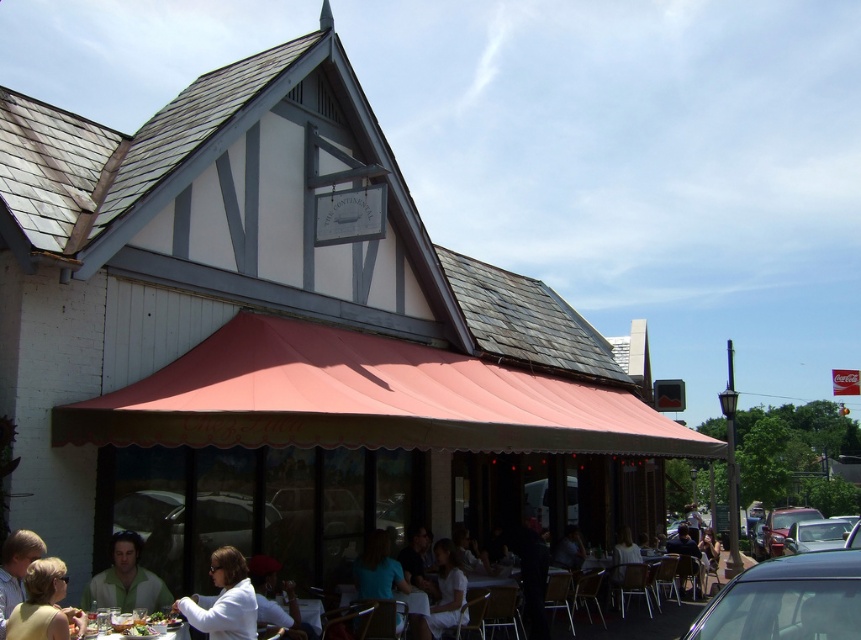
Is metallic blue car at lower right wider than green matte shirt at lower center?

Correct, the width of metallic blue car at lower right exceeds that of green matte shirt at lower center.

In the scene shown: Which is more to the right, metallic blue car at lower right or green matte shirt at lower center?

From the viewer's perspective, metallic blue car at lower right appears more on the right side.

The image size is (861, 640). What are the coordinates of `metallic blue car at lower right` in the screenshot? It's located at (787, 600).

Identify the location of metallic blue car at lower right. (787, 600).

Who is lower down, metallic blue car at lower right or white matte shirt at lower center?

white matte shirt at lower center is below.

Measure the distance between point (728, 586) and camera.

Point (728, 586) is 5.61 meters from camera.

The height and width of the screenshot is (640, 861). What are the coordinates of `metallic blue car at lower right` in the screenshot? It's located at (787, 600).

Can you confirm if green matte shirt at lower center is thinner than white fabric dress at lower center?

In fact, green matte shirt at lower center might be wider than white fabric dress at lower center.

Is green matte shirt at lower center shorter than white fabric dress at lower center?

Yes.

Measure the distance between point (98, 582) and camera.

Point (98, 582) is 24.83 feet from camera.

The height and width of the screenshot is (640, 861). I want to click on green matte shirt at lower center, so [x=127, y=580].